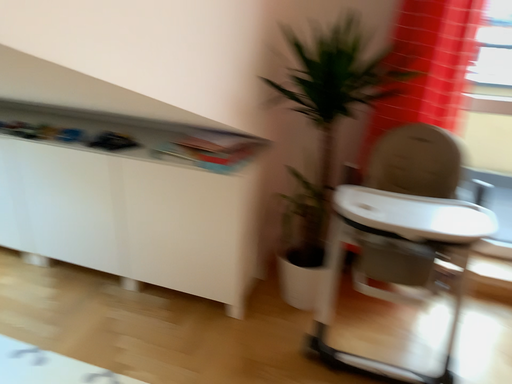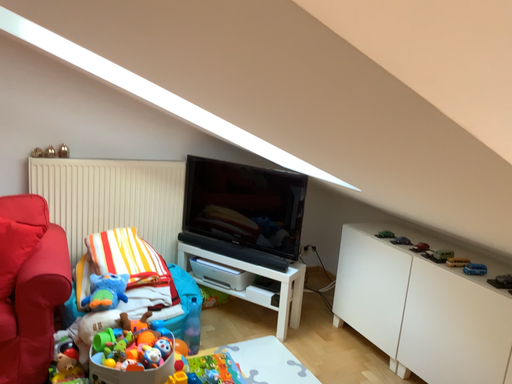
Question: Which way did the camera rotate in the video?

Choices:
 (A) rotated downward
 (B) rotated upward

Answer: (B)